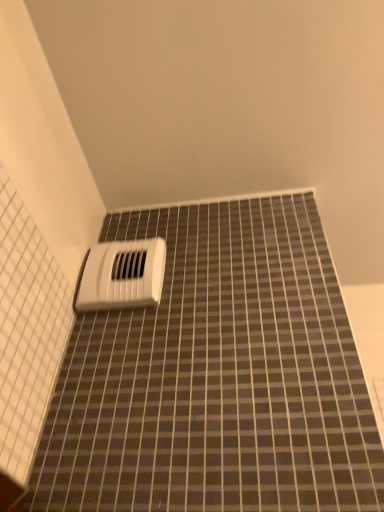
This screenshot has width=384, height=512. What do you see at coordinates (122, 275) in the screenshot? I see `white plastic vent at upper center` at bounding box center [122, 275].

Locate an element on the screen. white plastic vent at upper center is located at coordinates (122, 275).

In order to click on white plastic vent at upper center in this screenshot , I will do `click(122, 275)`.